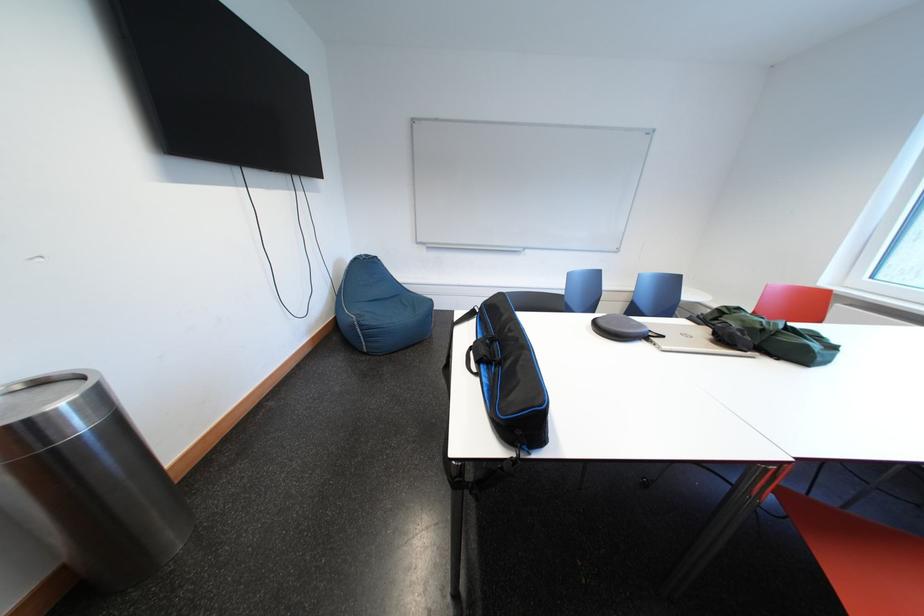
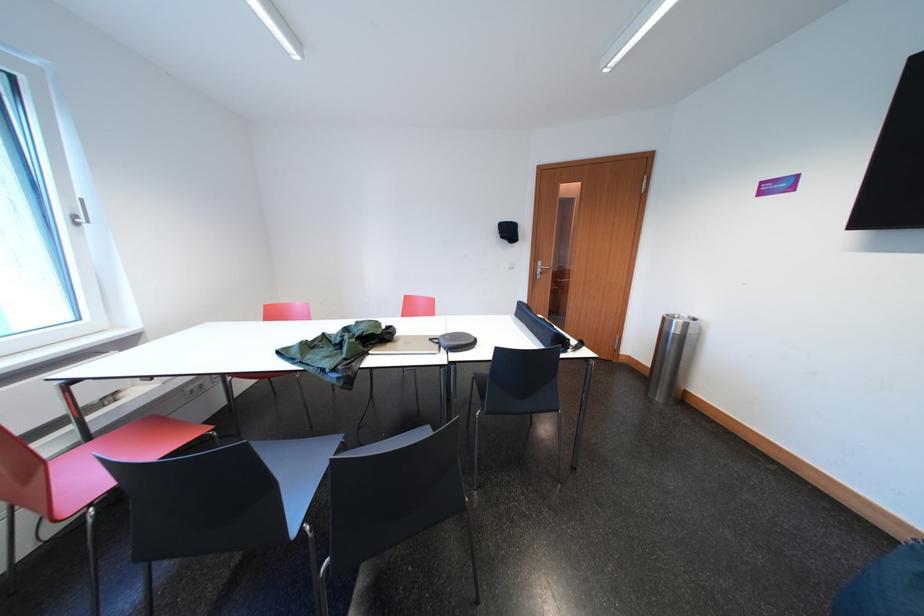
Where in the second image is the point corresponding to (x=30, y=439) from the first image?

(672, 323)